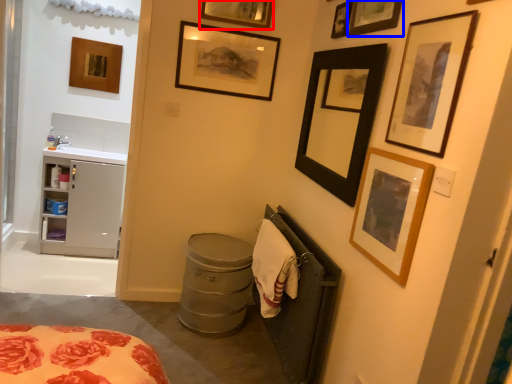
Question: Which point is further to the camera, picture frame (highlighted by a red box) or picture frame (highlighted by a blue box)?

Choices:
 (A) picture frame
 (B) picture frame

Answer: (A)